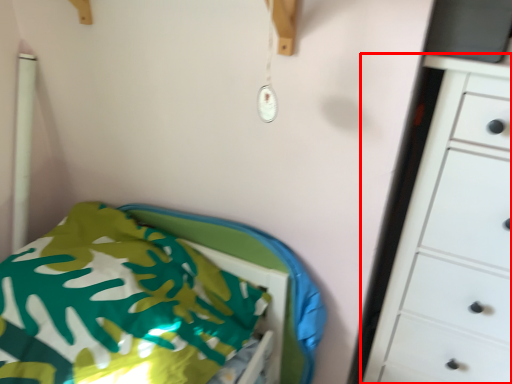
Question: From the image's perspective, where is chest of drawers (annotated by the red box) located in relation to furniture in the image?

Choices:
 (A) above
 (B) below

Answer: (A)